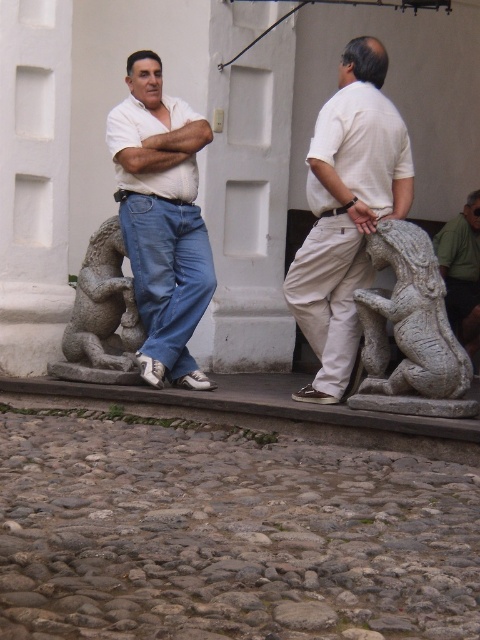
Consider the image. You are a photographer trying to capture a portrait of the two men. You notice the khaki pants at center and the matte white shirt at center. Which clothing item is positioned lower on the body?

The khaki pants at center is located below matte white shirt at center, so the khaki pants at center is positioned lower on the body.